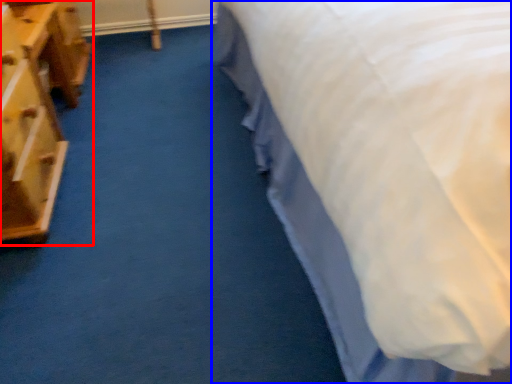
Question: Which object appears farthest to the camera in this image, furniture (highlighted by a red box) or bed (highlighted by a blue box)?

Choices:
 (A) furniture
 (B) bed

Answer: (A)